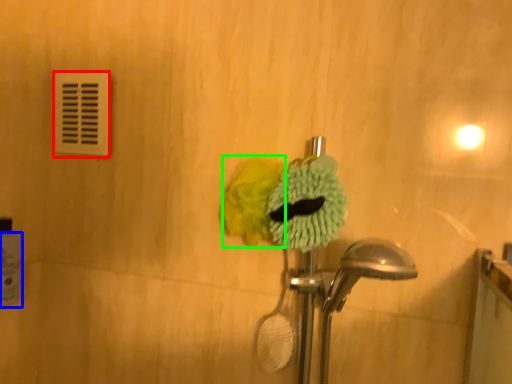
Question: Estimate the real-world distances between objects in this image. Which object is closer to light switch (highlighted by a red box), toilet paper (highlighted by a blue box) or flower (highlighted by a green box)?

Choices:
 (A) toilet paper
 (B) flower

Answer: (A)